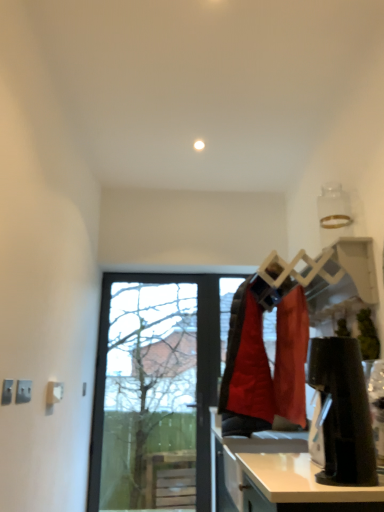
The image size is (384, 512). What are the coordinates of `light brown laminate counter top at lower right` in the screenshot? It's located at (300, 480).

The width and height of the screenshot is (384, 512). What do you see at coordinates (300, 480) in the screenshot? I see `light brown laminate counter top at lower right` at bounding box center [300, 480].

This screenshot has width=384, height=512. I want to click on transparent glass door at center, so click(153, 384).

Image resolution: width=384 pixels, height=512 pixels. What do you see at coordinates (153, 384) in the screenshot? I see `transparent glass door at center` at bounding box center [153, 384].

Image resolution: width=384 pixels, height=512 pixels. I want to click on light brown laminate counter top at lower right, so pos(300,480).

In the image, is light brown laminate counter top at lower right on the left side or the right side of transparent glass door at center?

Based on their positions, light brown laminate counter top at lower right is located to the right of transparent glass door at center.

Is light brown laminate counter top at lower right positioned behind transparent glass door at center?

No.

Does point (345, 497) appear closer or farther from the camera than point (166, 429)?

Point (345, 497) is closer to the camera than point (166, 429).

Looking at this image, from the image's perspective, is light brown laminate counter top at lower right beneath transparent glass door at center?

Indeed, from the image's perspective, light brown laminate counter top at lower right is shown beneath transparent glass door at center.

From a real-world perspective, between light brown laminate counter top at lower right and transparent glass door at center, who is vertically higher?

transparent glass door at center, from a real-world perspective.

Which of these two, light brown laminate counter top at lower right or transparent glass door at center, is wider?

light brown laminate counter top at lower right.

Does light brown laminate counter top at lower right have a greater height compared to transparent glass door at center?

Incorrect, the height of light brown laminate counter top at lower right is not larger of that of transparent glass door at center.

Is light brown laminate counter top at lower right bigger or smaller than transparent glass door at center?

In the image, light brown laminate counter top at lower right appears to be smaller than transparent glass door at center.

Is transparent glass door at center inside light brown laminate counter top at lower right?

Definitely not — transparent glass door at center is not inside light brown laminate counter top at lower right.

Is light brown laminate counter top at lower right positioned far away from transparent glass door at center?

Yes, light brown laminate counter top at lower right and transparent glass door at center are located far from each other.

Is light brown laminate counter top at lower right oriented away from transparent glass door at center?

No, transparent glass door at center is not at the back of light brown laminate counter top at lower right.

Could you measure the distance between light brown laminate counter top at lower right and transparent glass door at center?

light brown laminate counter top at lower right and transparent glass door at center are 1.90 meters apart.

Identify the location of counter top lying in front of the transparent glass door at center. (300, 480).

Is transparent glass door at center to the left or to the right of light brown laminate counter top at lower right in the image?

In the image, transparent glass door at center appears on the left side of light brown laminate counter top at lower right.

Which object is closer to the camera, transparent glass door at center or light brown laminate counter top at lower right?

light brown laminate counter top at lower right is in front.

Does point (148, 439) appear closer or farther from the camera than point (335, 492)?

Point (148, 439).

From the image's perspective, between transparent glass door at center and light brown laminate counter top at lower right, which one is located above?

transparent glass door at center is shown above in the image.

From a real-world perspective, which object stands above the other?

transparent glass door at center, from a real-world perspective.

In terms of width, does transparent glass door at center look wider or thinner when compared to light brown laminate counter top at lower right?

Clearly, transparent glass door at center has less width compared to light brown laminate counter top at lower right.

Considering the relative sizes of transparent glass door at center and light brown laminate counter top at lower right in the image provided, is transparent glass door at center shorter than light brown laminate counter top at lower right?

No, transparent glass door at center is not shorter than light brown laminate counter top at lower right.

From the picture: Between transparent glass door at center and light brown laminate counter top at lower right, which one has smaller size?

Smaller between the two is light brown laminate counter top at lower right.

Is light brown laminate counter top at lower right a part of transparent glass door at center?

That's incorrect, light brown laminate counter top at lower right is not inside transparent glass door at center.

Is transparent glass door at center with light brown laminate counter top at lower right?

No, transparent glass door at center is not with light brown laminate counter top at lower right.

Could you tell me if transparent glass door at center is turned towards light brown laminate counter top at lower right?

Yes.

This screenshot has height=512, width=384. What are the coordinates of `counter top on the right side of transparent glass door at center` in the screenshot? It's located at (300, 480).

Image resolution: width=384 pixels, height=512 pixels. Find the location of `counter top lying below the transparent glass door at center (from the image's perspective)`. counter top lying below the transparent glass door at center (from the image's perspective) is located at coordinates (300, 480).

Locate an element on the screen. Image resolution: width=384 pixels, height=512 pixels. counter top below the transparent glass door at center (from a real-world perspective) is located at coordinates (300, 480).